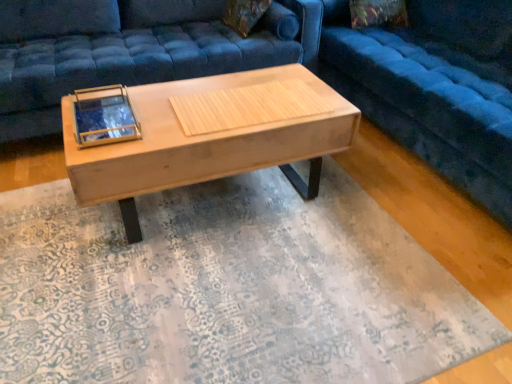
At what (x,y) coordinates should I click in order to perform the action: click on free space above natural wood coffee table at center (from a real-world perspective). Please return your answer as a coordinate pair (x, y). Looking at the image, I should click on (189, 112).